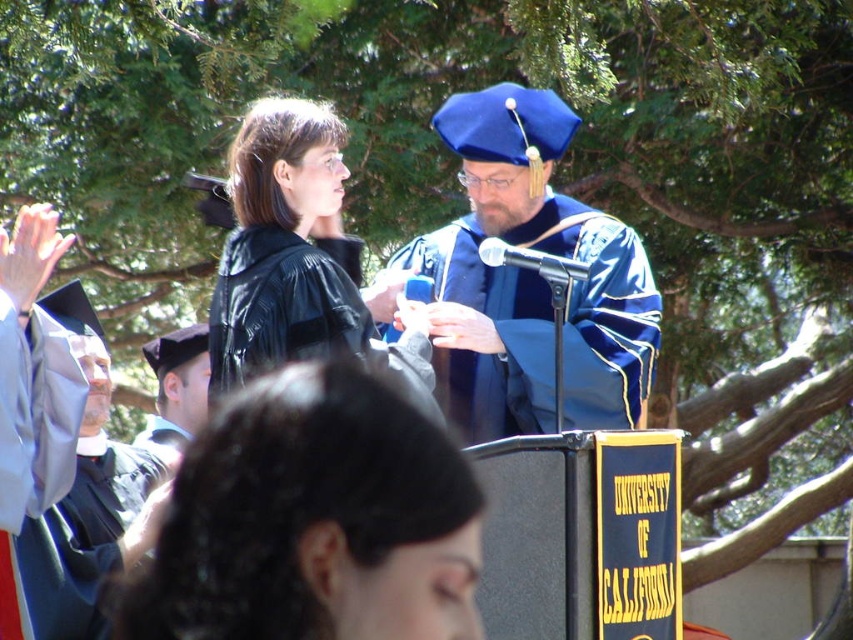
Question: Which object is the farthest from the black matte graduation gown at center?

Choices:
 (A) matte black graduation gown at left
 (B) matte black graduation cap at left
 (C) matte black gown at upper left
 (D) blue satin graduation gown at center

Answer: (B)

Question: Can you confirm if matte black gown at upper left is bigger than matte black graduation gown at left?

Choices:
 (A) yes
 (B) no

Answer: (B)

Question: Can you confirm if black matte graduation gown at center is positioned to the left of matte black graduation gown at left?

Choices:
 (A) yes
 (B) no

Answer: (B)

Question: Observing the image, what is the correct spatial positioning of matte black gown at upper left in reference to matte black graduation gown at left?

Choices:
 (A) above
 (B) below

Answer: (A)

Question: Which point is farther from the camera taking this photo?

Choices:
 (A) (149, 360)
 (B) (546, 333)

Answer: (A)

Question: Among these objects, which one is nearest to the camera?

Choices:
 (A) matte black gown at upper left
 (B) matte black graduation gown at left
 (C) blue satin graduation gown at center

Answer: (A)